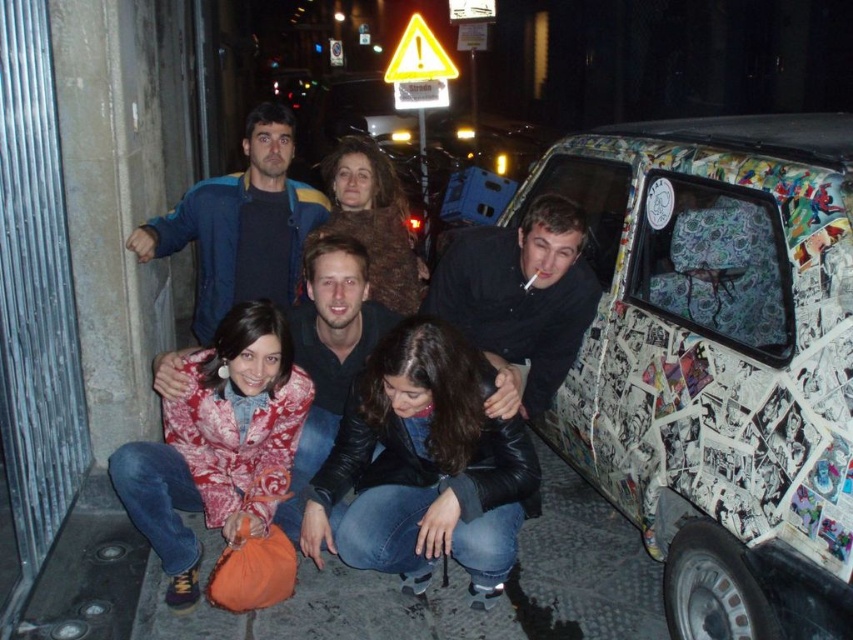
Is white comic book pages van at right above leather jacket at center?

Correct, white comic book pages van at right is located above leather jacket at center.

Measure the distance from white comic book pages van at right to leather jacket at center.

white comic book pages van at right is 36.45 inches away from leather jacket at center.

Locate an element on the screen. The image size is (853, 640). white comic book pages van at right is located at coordinates (718, 360).

Does white comic book pages van at right have a greater height compared to printed fabric jacket at lower left?

Correct, white comic book pages van at right is much taller as printed fabric jacket at lower left.

Find the location of a particular element. white comic book pages van at right is located at coordinates (718, 360).

Is point (633, 452) positioned before point (216, 346)?

No, (633, 452) is further to viewer.

Locate an element on the screen. The height and width of the screenshot is (640, 853). white comic book pages van at right is located at coordinates (718, 360).

In the scene shown: Does leather jacket at center come behind printed fabric jacket at lower left?

No, it is not.

Does leather jacket at center have a larger size compared to printed fabric jacket at lower left?

Correct, leather jacket at center is larger in size than printed fabric jacket at lower left.

Is point (361, 481) positioned behind point (154, 516)?

Yes.

This screenshot has height=640, width=853. In order to click on leather jacket at center in this screenshot , I will do `click(424, 465)`.